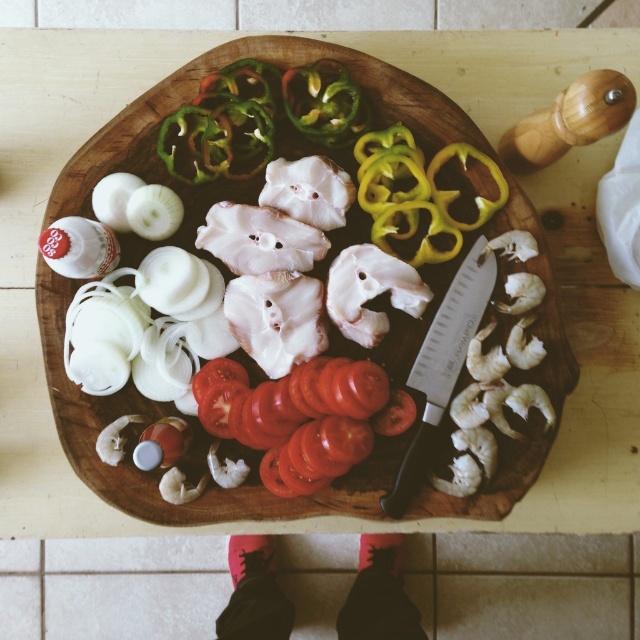
At what (x,y) coordinates should I click in order to perform the action: click on wooden cutting board at center. Please return your answer as a coordinate pair (x, y). This screenshot has height=640, width=640. Looking at the image, I should click on (156, 419).

Is wooden cutting board at center taller than green glossy bell pepper at upper center?

Yes.

Between point (225, 504) and point (330, 113), which one is positioned in front?

Point (330, 113) is more forward.

Identify the location of wooden cutting board at center. This screenshot has width=640, height=640. (156, 419).

How distant is silver metallic knife at center from green glossy bell pepper at upper center?

silver metallic knife at center is 22.31 centimeters away from green glossy bell pepper at upper center.

Is silver metallic knife at center further to camera compared to green glossy bell pepper at upper center?

That is True.

Describe the element at coordinates (442, 362) in the screenshot. I see `silver metallic knife at center` at that location.

Identify the location of silver metallic knife at center. The image size is (640, 640). click(x=442, y=362).

The width and height of the screenshot is (640, 640). Describe the element at coordinates (156, 419) in the screenshot. I see `wooden cutting board at center` at that location.

Who is positioned more to the left, wooden cutting board at center or silver metallic knife at center?

wooden cutting board at center is more to the left.

Is point (80, 417) in front of point (474, 289)?

Yes, point (80, 417) is in front of point (474, 289).

You are a GUI agent. You are given a task and a screenshot of the screen. Output one action in this format:
    pyautogui.click(x=<x>, y=<y>)
    Task: Click on the wooden cutting board at center
    Image resolution: width=640 pixels, height=640 pixels.
    Given the screenshot: What is the action you would take?
    pyautogui.click(x=156, y=419)